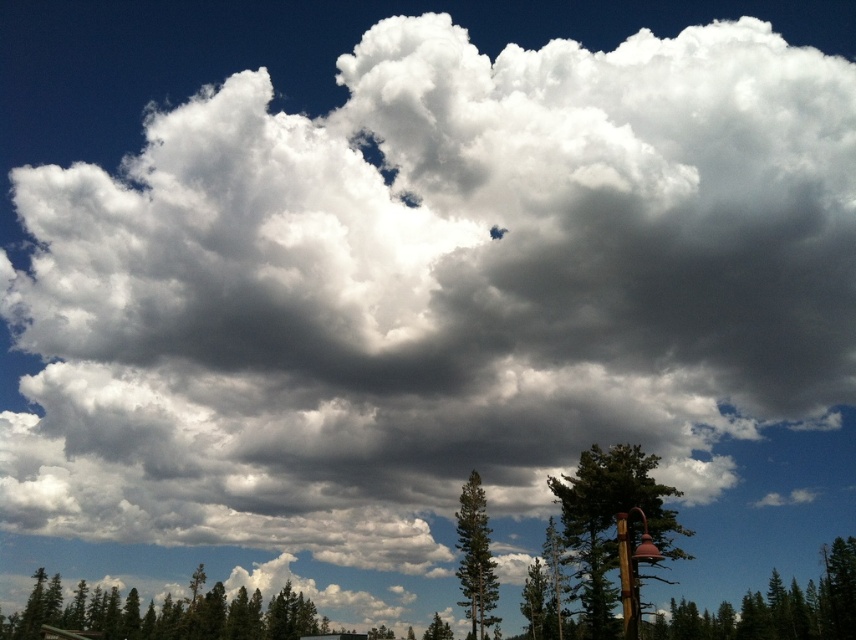
Question: Is green textured tree at lower left closer to the viewer compared to green textured tree at lower right?

Choices:
 (A) no
 (B) yes

Answer: (A)

Question: Where is green textured tree at center located in relation to green textured tree at lower center in the image?

Choices:
 (A) below
 (B) above

Answer: (B)

Question: Which of the following is the closest to the observer?

Choices:
 (A) green textured tree at lower left
 (B) green textured tree at lower right
 (C) green textured tree at center

Answer: (B)

Question: Estimate the real-world distances between objects in this image. Which object is closer to the green textured tree at center?

Choices:
 (A) green textured tree at lower left
 (B) green matte tree at lower right
 (C) green matte tree at center
 (D) green textured tree at lower right

Answer: (C)

Question: Which object is positioned farthest from the green textured tree at lower center?

Choices:
 (A) green textured tree at lower right
 (B) green textured tree at center
 (C) green textured tree at lower left

Answer: (B)

Question: Is green textured tree at lower left smaller than green textured tree at center?

Choices:
 (A) no
 (B) yes

Answer: (A)